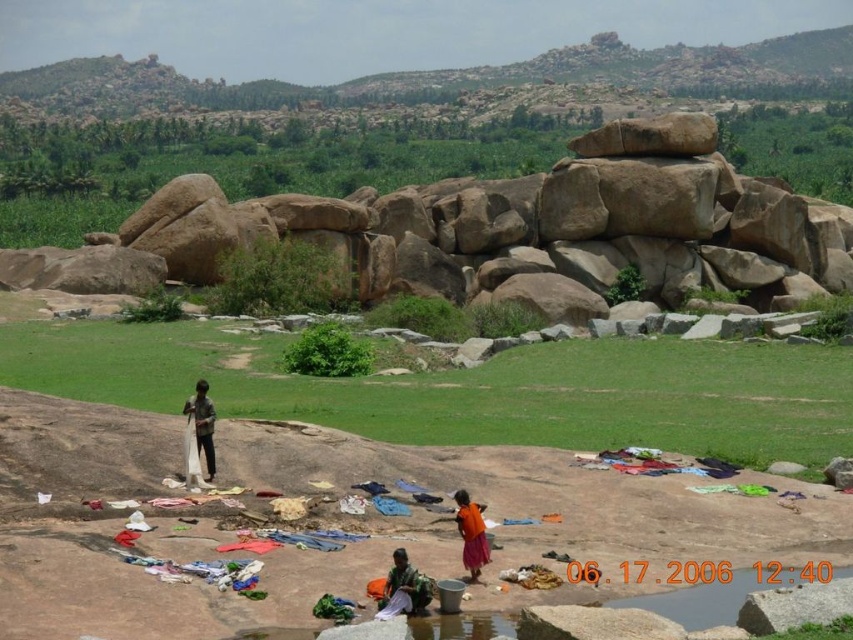
Question: Considering the real-world distances, which object is farthest from the orange cotton dress at center?

Choices:
 (A) white cotton cloth at lower center
 (B) dark brown fabric at center

Answer: (B)

Question: Among these points, which one is nearest to the camera?

Choices:
 (A) (462, 560)
 (B) (427, 586)

Answer: (B)

Question: Is white cotton cloth at lower center in front of dark brown fabric at center?

Choices:
 (A) no
 (B) yes

Answer: (B)

Question: Does white cotton cloth at lower center appear on the right side of orange cotton dress at center?

Choices:
 (A) no
 (B) yes

Answer: (A)

Question: Among these objects, which one is nearest to the camera?

Choices:
 (A) white cotton cloth at lower center
 (B) dark brown fabric at center

Answer: (A)

Question: Is white cotton cloth at lower center thinner than orange cotton dress at center?

Choices:
 (A) no
 (B) yes

Answer: (A)